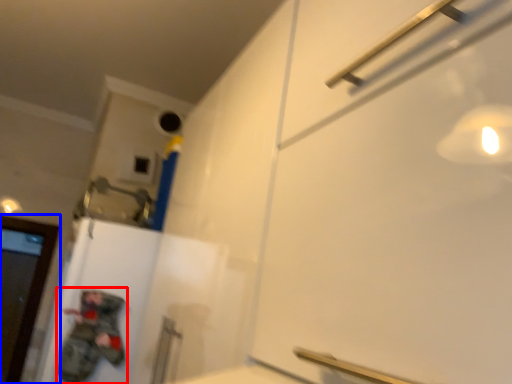
Question: Which point is further to the camera, person (highlighted by a red box) or door (highlighted by a blue box)?

Choices:
 (A) person
 (B) door

Answer: (B)